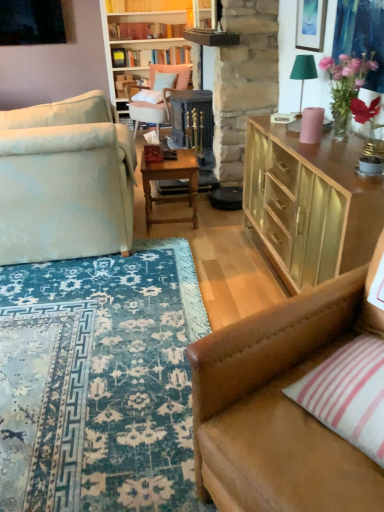
Question: Considering the positions of hardcover books at upper center, the 2th book positioned from the front, and matte gold picture frame at upper right in the image, is hardcover books at upper center, the 2th book positioned from the front, wider or thinner than matte gold picture frame at upper right?

Choices:
 (A) thin
 (B) wide

Answer: (B)

Question: Would you say hardcover books at upper center, the first book in the bottom-to-top sequence, is to the left or to the right of matte gold picture frame at upper right in the picture?

Choices:
 (A) left
 (B) right

Answer: (A)

Question: Based on their relative distances, which object is farther from the pink glass vase at upper right?

Choices:
 (A) wooden table at center
 (B) matte gold cabinet at upper right
 (C) pink striped fabric pillow at lower right, the 2th pillow when ordered from left to right
 (D) brown leather couch at lower right, which is the 1th studio couch in bottom-to-top order
 (E) green fabric lampshade at upper right

Answer: (C)

Question: Considering the real-world distances, which object is closest to the hardcover books at upper center, the first book in the bottom-to-top sequence?

Choices:
 (A) matte gold picture frame at upper right
 (B) pink striped fabric pillow at lower right, the 1th pillow in the bottom-to-top sequence
 (C) matte gold cabinet at upper right
 (D) white fabric pillow at center, which appears as the 1th pillow when viewed from the top
 (E) pink fabric chair at upper center

Answer: (E)